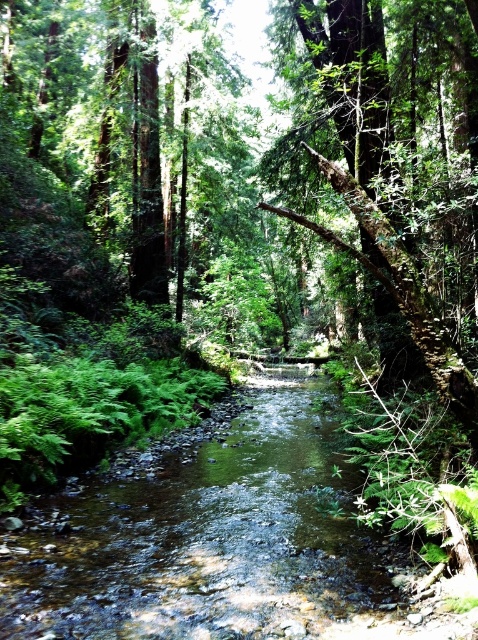
Question: Which point appears farthest from the camera in this image?

Choices:
 (A) (381, 214)
 (B) (239, 595)

Answer: (B)

Question: Is clear water stream at center positioned in front of mossy bark tree at center?

Choices:
 (A) yes
 (B) no

Answer: (A)

Question: Is the position of clear water stream at center less distant than that of mossy bark tree at center?

Choices:
 (A) no
 (B) yes

Answer: (B)

Question: Does clear water stream at center have a larger size compared to mossy bark tree at center?

Choices:
 (A) no
 (B) yes

Answer: (A)